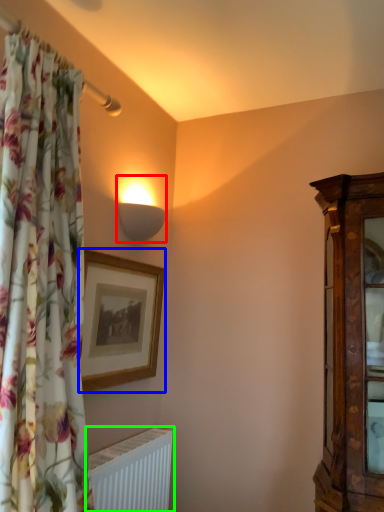
Question: Based on their relative distances, which object is nearer to lamp (highlighted by a red box)? Choose from picture frame (highlighted by a blue box) and radiator (highlighted by a green box).

Choices:
 (A) picture frame
 (B) radiator

Answer: (A)